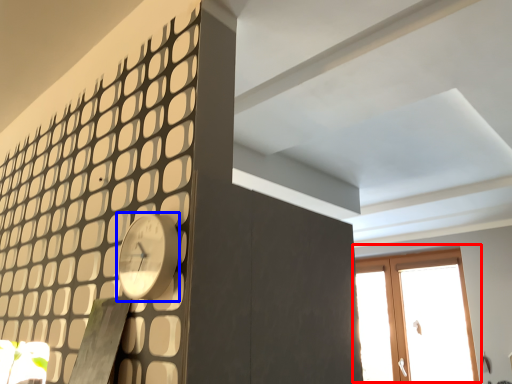
Question: Which object is further to the camera taking this photo, window (highlighted by a red box) or clock (highlighted by a blue box)?

Choices:
 (A) window
 (B) clock

Answer: (A)